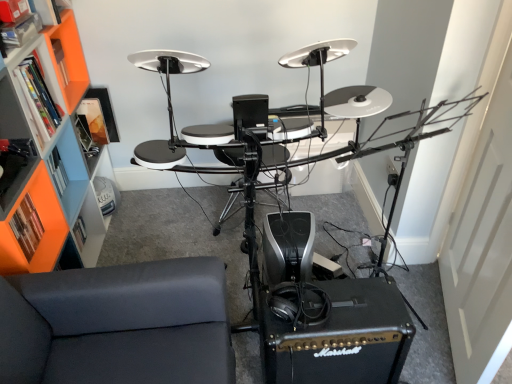
This screenshot has height=384, width=512. Describe the element at coordinates (50, 157) in the screenshot. I see `orange plastic bookshelf at left` at that location.

The width and height of the screenshot is (512, 384). What are the coordinates of `orange matte bookshelf at left, which is the first shelf from bottom to top` in the screenshot? It's located at (33, 227).

Find the location of `orange plastic bookshelf at left`. orange plastic bookshelf at left is located at coordinates (50, 157).

Which of these two, orange matte bookshelf at left, which is the 2th shelf from top to bottom, or orange plastic bookshelf at left, is bigger?

With larger size is orange plastic bookshelf at left.

At what (x,y) coordinates should I click in order to perform the action: click on shelf below the orange plastic bookshelf at left (from a real-world perspective). Please return your answer as a coordinate pair (x, y). The width and height of the screenshot is (512, 384). Looking at the image, I should click on (33, 227).

Considering the positions of objects orange matte bookshelf at left, which is the first shelf from bottom to top, and orange plastic bookshelf at left in the image provided, who is in front, orange matte bookshelf at left, which is the first shelf from bottom to top, or orange plastic bookshelf at left?

Positioned in front is orange plastic bookshelf at left.

From the image's perspective, which is above, dark gray fabric couch at lower left or orange matte bookshelf at left, which is the 2th shelf from top to bottom?

orange matte bookshelf at left, which is the 2th shelf from top to bottom, appears higher in the image.

Looking at this image, is dark gray fabric couch at lower left touching orange matte bookshelf at left, which is the 2th shelf from top to bottom?

No, dark gray fabric couch at lower left is not beside orange matte bookshelf at left, which is the 2th shelf from top to bottom.

Starting from the dark gray fabric couch at lower left, which shelf is the 2nd one to the left? Please provide its 2D coordinates.

[(33, 227)]

Is orange matte bookshelf at left, which is the 2th shelf from top to bottom, located outside orange plastic shelf at left, which ranks as the second shelf in bottom-to-top order?

Yes, orange matte bookshelf at left, which is the 2th shelf from top to bottom, is not within orange plastic shelf at left, which ranks as the second shelf in bottom-to-top order.

Could you tell me if orange matte bookshelf at left, which is the 2th shelf from top to bottom, is facing orange plastic shelf at left, marked as the 1th shelf in a top-to-bottom arrangement?

No, orange matte bookshelf at left, which is the 2th shelf from top to bottom, is not facing towards orange plastic shelf at left, marked as the 1th shelf in a top-to-bottom arrangement.

The width and height of the screenshot is (512, 384). In order to click on shelf above the orange matte bookshelf at left, which is the first shelf from bottom to top (from a real-world perspective) in this screenshot , I will do `click(13, 147)`.

Considering their positions, is dark gray fabric couch at lower left located in front of or behind orange plastic bookshelf at left?

Clearly, dark gray fabric couch at lower left is in front of orange plastic bookshelf at left.

What's the angular difference between dark gray fabric couch at lower left and orange plastic bookshelf at left's facing directions?

The facing directions of dark gray fabric couch at lower left and orange plastic bookshelf at left are 0.92 degrees apart.

From the picture: Who is smaller, dark gray fabric couch at lower left or orange plastic bookshelf at left?

With smaller size is dark gray fabric couch at lower left.

Is orange plastic bookshelf at left inside dark gray fabric couch at lower left?

No, orange plastic bookshelf at left is not a part of dark gray fabric couch at lower left.

Considering the sizes of objects orange plastic shelf at left, which ranks as the second shelf in bottom-to-top order, and orange matte bookshelf at left, which is the 2th shelf from top to bottom, in the image provided, who is smaller, orange plastic shelf at left, which ranks as the second shelf in bottom-to-top order, or orange matte bookshelf at left, which is the 2th shelf from top to bottom,?

Smaller between the two is orange matte bookshelf at left, which is the 2th shelf from top to bottom.

Is point (1, 199) positioned in front of point (46, 227)?

Yes, it is.

How far apart are orange plastic shelf at left, marked as the 1th shelf in a top-to-bottom arrangement, and orange matte bookshelf at left, which is the first shelf from bottom to top?

orange plastic shelf at left, marked as the 1th shelf in a top-to-bottom arrangement, is 7.81 inches away from orange matte bookshelf at left, which is the first shelf from bottom to top.

From a real-world perspective, who is located lower, orange plastic bookshelf at left or orange matte bookshelf at left, which is the first shelf from bottom to top?

From a 3D spatial view, orange matte bookshelf at left, which is the first shelf from bottom to top, is below.

Is orange plastic bookshelf at left oriented towards orange matte bookshelf at left, which is the first shelf from bottom to top?

Yes, orange plastic bookshelf at left is aimed at orange matte bookshelf at left, which is the first shelf from bottom to top.

How many degrees apart are the facing directions of orange plastic bookshelf at left and orange matte bookshelf at left, which is the first shelf from bottom to top?

The facing directions of orange plastic bookshelf at left and orange matte bookshelf at left, which is the first shelf from bottom to top, are 1.62 degrees apart.

Considering the sizes of orange plastic bookshelf at left and orange matte bookshelf at left, which is the 2th shelf from top to bottom, in the image, is orange plastic bookshelf at left wider or thinner than orange matte bookshelf at left, which is the 2th shelf from top to bottom,?

In the image, orange plastic bookshelf at left appears to be wider than orange matte bookshelf at left, which is the 2th shelf from top to bottom.

Where is `shelf above the orange plastic bookshelf at left (from a real-world perspective)`? The height and width of the screenshot is (384, 512). shelf above the orange plastic bookshelf at left (from a real-world perspective) is located at coordinates [13, 147].

Does orange plastic shelf at left, which ranks as the second shelf in bottom-to-top order, have a larger size compared to orange plastic bookshelf at left?

No.

Is orange plastic shelf at left, marked as the 1th shelf in a top-to-bottom arrangement, behind orange plastic bookshelf at left?

Yes, it is.

From the orange plastic bookshelf at left, count 1st shelf to the right and point to it. Please provide its 2D coordinates.

[(33, 227)]

There is a dark gray fabric couch at lower left. Where is `the 1st shelf above it (from the image's perspective)`? the 1st shelf above it (from the image's perspective) is located at coordinates (33, 227).

When comparing their distances from dark gray fabric couch at lower left, does orange plastic bookshelf at left or orange plastic shelf at left, which ranks as the second shelf in bottom-to-top order, seem further?

orange plastic bookshelf at left is further to dark gray fabric couch at lower left.

When comparing their distances from orange matte bookshelf at left, which is the first shelf from bottom to top, does orange plastic bookshelf at left or dark gray fabric couch at lower left seem closer?

Among the two, orange plastic bookshelf at left is located nearer to orange matte bookshelf at left, which is the first shelf from bottom to top.

Looking at this image, when comparing their distances from orange matte bookshelf at left, which is the 2th shelf from top to bottom, does orange plastic shelf at left, marked as the 1th shelf in a top-to-bottom arrangement, or orange plastic bookshelf at left seem further?

orange plastic shelf at left, marked as the 1th shelf in a top-to-bottom arrangement, is further to orange matte bookshelf at left, which is the 2th shelf from top to bottom.

From the image, which object appears to be farther from orange plastic bookshelf at left, dark gray fabric couch at lower left or orange plastic shelf at left, marked as the 1th shelf in a top-to-bottom arrangement?

dark gray fabric couch at lower left is positioned further to the anchor orange plastic bookshelf at left.

Which object lies further to the anchor point orange plastic shelf at left, marked as the 1th shelf in a top-to-bottom arrangement, orange plastic bookshelf at left or dark gray fabric couch at lower left?

dark gray fabric couch at lower left.

From the image, which object appears to be farther from orange plastic shelf at left, marked as the 1th shelf in a top-to-bottom arrangement, dark gray fabric couch at lower left or orange plastic bookshelf at left?

dark gray fabric couch at lower left is further to orange plastic shelf at left, marked as the 1th shelf in a top-to-bottom arrangement.

Looking at this image, based on their spatial positions, is orange plastic shelf at left, which ranks as the second shelf in bottom-to-top order, or orange matte bookshelf at left, which is the 2th shelf from top to bottom, further from dark gray fabric couch at lower left?

Among the two, orange plastic shelf at left, which ranks as the second shelf in bottom-to-top order, is located further to dark gray fabric couch at lower left.

Looking at the image, which one is located further to orange plastic shelf at left, which ranks as the second shelf in bottom-to-top order, orange matte bookshelf at left, which is the 2th shelf from top to bottom, or orange plastic bookshelf at left?

Among the two, orange plastic bookshelf at left is located further to orange plastic shelf at left, which ranks as the second shelf in bottom-to-top order.

Where is `shelf between orange plastic shelf at left, marked as the 1th shelf in a top-to-bottom arrangement, and dark gray fabric couch at lower left in the up-down direction`? shelf between orange plastic shelf at left, marked as the 1th shelf in a top-to-bottom arrangement, and dark gray fabric couch at lower left in the up-down direction is located at coordinates (33, 227).

Locate an element on the screen. This screenshot has height=384, width=512. shelf located between orange plastic bookshelf at left and orange matte bookshelf at left, which is the 2th shelf from top to bottom, in the depth direction is located at coordinates (13, 147).